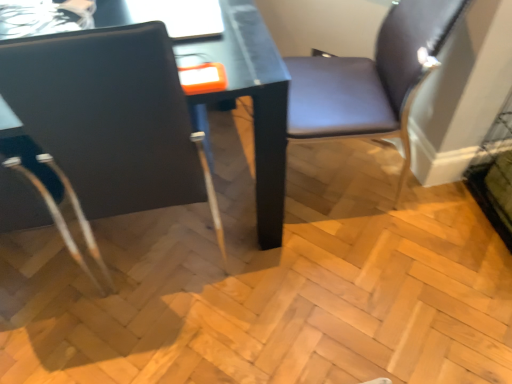
You are a GUI agent. You are given a task and a screenshot of the screen. Output one action in this format:
    pyautogui.click(x=<x>, y=<y>)
    Task: Click on the free spot below purple leather chair at right, the first chair positioned from the right (from a real-world perspective)
    This screenshot has width=512, height=384.
    Given the screenshot: What is the action you would take?
    pyautogui.click(x=329, y=179)